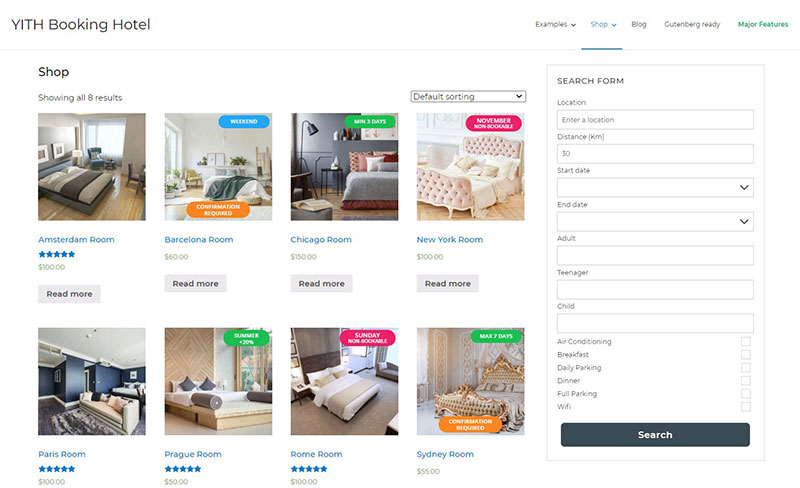
The height and width of the screenshot is (488, 800). Find the location of `beds`. beds is located at coordinates (66, 190), (230, 185), (373, 182), (482, 179), (128, 387), (182, 392), (324, 386), (493, 394).